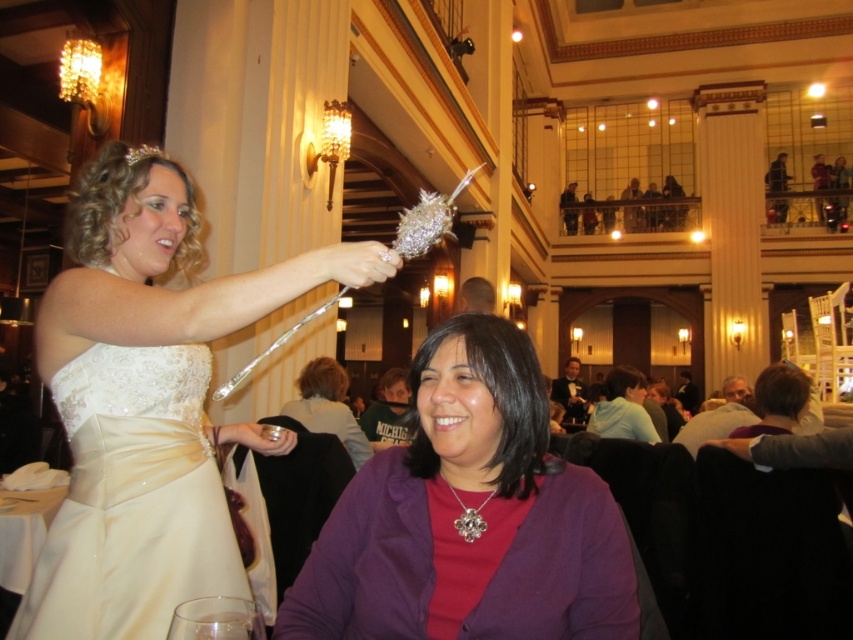
Who is more distant from viewer, (149, 416) or (407, 452)?

The point (149, 416) is behind.

Where is `matte white dress at center`? The height and width of the screenshot is (640, 853). matte white dress at center is located at coordinates (148, 401).

Is point (109, 493) behind point (427, 381)?

That is True.

At what (x,y) coordinates should I click in order to perform the action: click on matte white dress at center. Please return your answer as a coordinate pair (x, y). The width and height of the screenshot is (853, 640). Looking at the image, I should click on (148, 401).

Can you confirm if matte white dress at center is shorter than light blue hoodie at center?

Incorrect, matte white dress at center's height does not fall short of light blue hoodie at center's.

Is point (74, 550) positioned behind point (596, 433)?

No.

The image size is (853, 640). I want to click on matte white dress at center, so click(x=148, y=401).

Is ivory satin dress at upper left to the left of light blue hoodie at center from the viewer's perspective?

Indeed, ivory satin dress at upper left is positioned on the left side of light blue hoodie at center.

Can you confirm if ivory satin dress at upper left is thinner than light blue hoodie at center?

Yes, ivory satin dress at upper left is thinner than light blue hoodie at center.

Between point (173, 592) and point (622, 385), which one is positioned in front?

Point (173, 592) is in front.

Find the location of a particular element. This screenshot has height=640, width=853. ivory satin dress at upper left is located at coordinates (x=132, y=499).